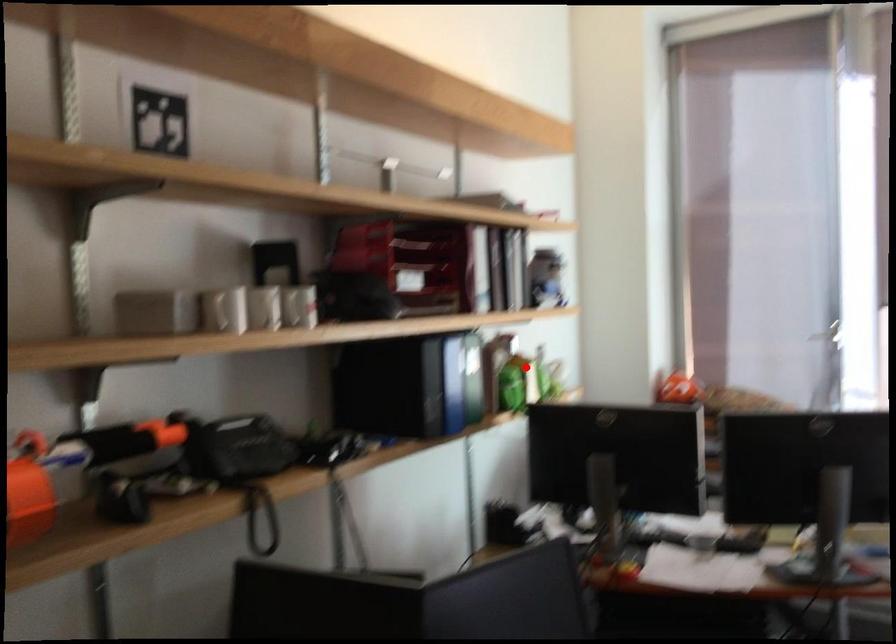
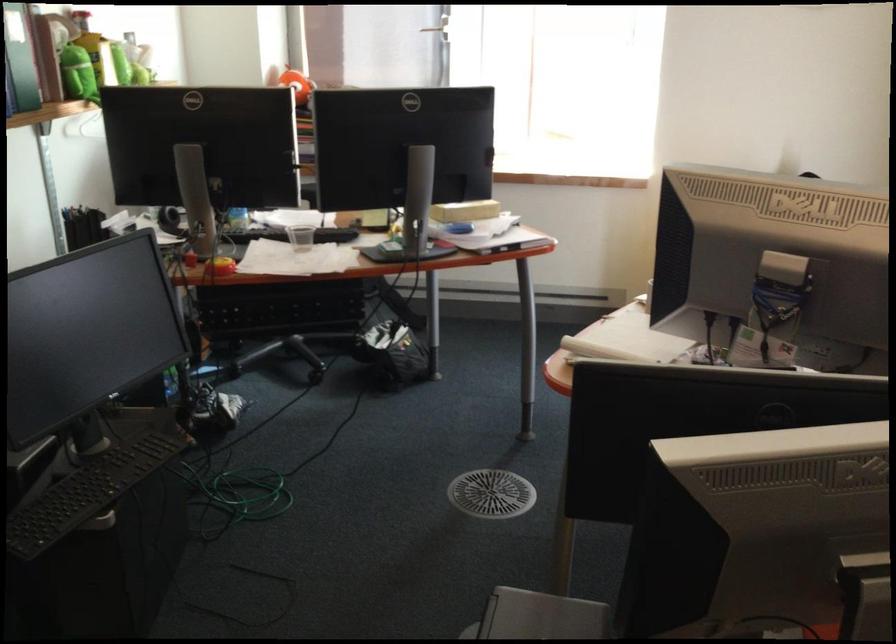
Question: I am providing you with two images of the same scene from different viewpoints. Given a red point in image1, look at the same physical point in image2. Is it:

Choices:
 (A) Closer to the viewpoint
 (B) Farther from the viewpoint

Answer: (A)